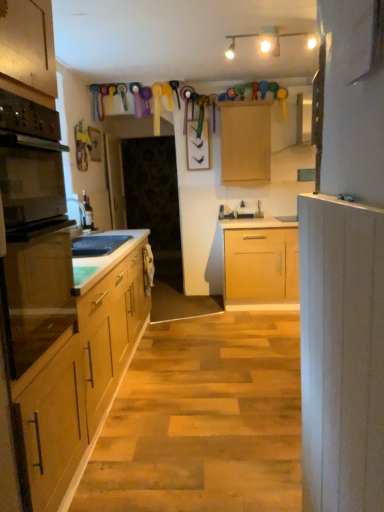
Question: From their relative heights in the image, would you say white frosted glass light fixture at upper center is taller or shorter than black glass oven at left?

Choices:
 (A) short
 (B) tall

Answer: (A)

Question: From the image's perspective, is white frosted glass light fixture at upper center located above or below black glass oven at left?

Choices:
 (A) below
 (B) above

Answer: (B)

Question: Estimate the real-world distances between objects in this image. Which object is closer to the black matte sink at left?

Choices:
 (A) black glass oven at left
 (B) matte wood cabinet at center, the second cabinetry positioned from the front
 (C) white frosted glass light fixture at upper center
 (D) white painted wood cabinet at right, acting as the 2th cabinetry starting from the back

Answer: (A)

Question: Estimate the real-world distances between objects in this image. Which object is closer to the matte wood cabinet at center, the second cabinetry positioned from the front?

Choices:
 (A) black glass oven at left
 (B) white frosted glass light fixture at upper center
 (C) white painted wood cabinet at right, placed as the first cabinetry when sorted from bottom to top
 (D) black matte sink at left

Answer: (B)